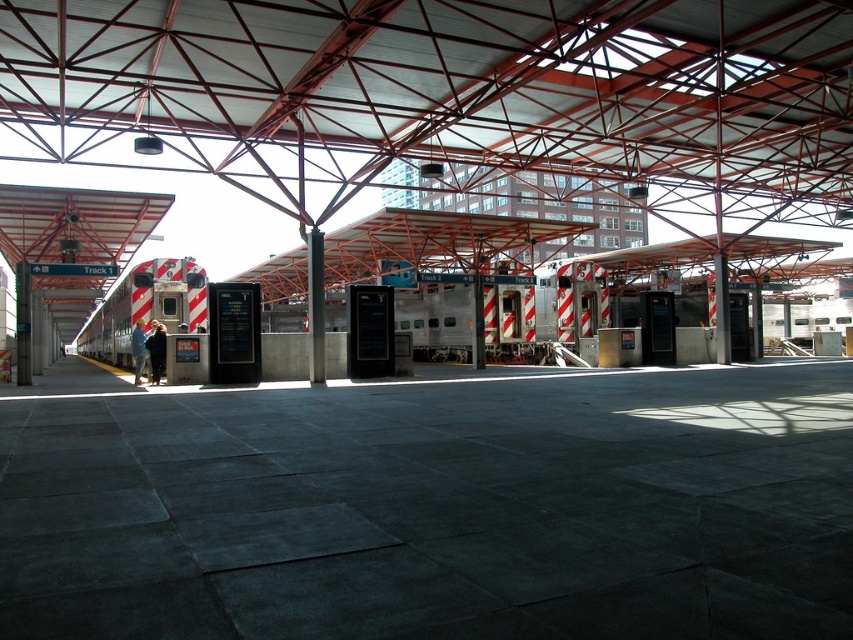
Question: Does silver metallic train at center have a greater width compared to silver metallic train at left?

Choices:
 (A) yes
 (B) no

Answer: (A)

Question: Is silver metallic train at center wider than silver metallic train at left?

Choices:
 (A) no
 (B) yes

Answer: (B)

Question: Which point is farther to the camera?

Choices:
 (A) 173,282
 (B) 143,300

Answer: (A)

Question: Does silver metallic train at center have a larger size compared to silver metallic train at left?

Choices:
 (A) no
 (B) yes

Answer: (B)